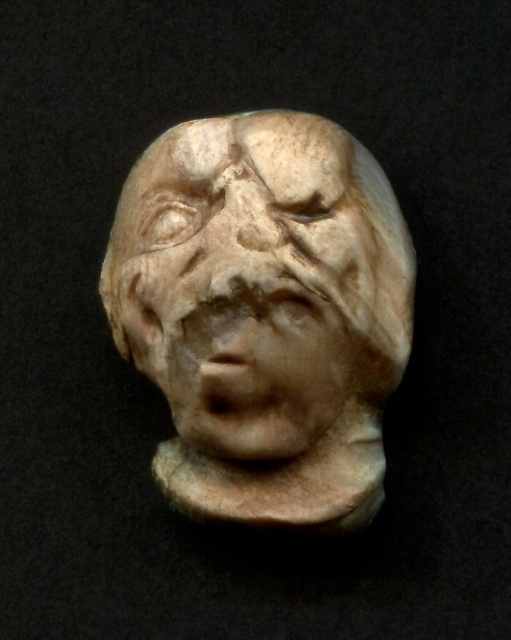
Question: Is white marble head at center to the right of white marble face at center from the viewer's perspective?

Choices:
 (A) yes
 (B) no

Answer: (A)

Question: Is white marble head at center positioned behind white marble face at center?

Choices:
 (A) yes
 (B) no

Answer: (A)

Question: Which object is farther from the camera taking this photo?

Choices:
 (A) white marble head at center
 (B) white marble face at center

Answer: (A)

Question: Among these points, which one is farthest from the camera?

Choices:
 (A) (218, 454)
 (B) (316, 273)

Answer: (A)

Question: Which point is farther to the camera?

Choices:
 (A) (284, 289)
 (B) (134, 301)

Answer: (B)

Question: Is white marble head at center to the right of white marble face at center from the viewer's perspective?

Choices:
 (A) no
 (B) yes

Answer: (B)